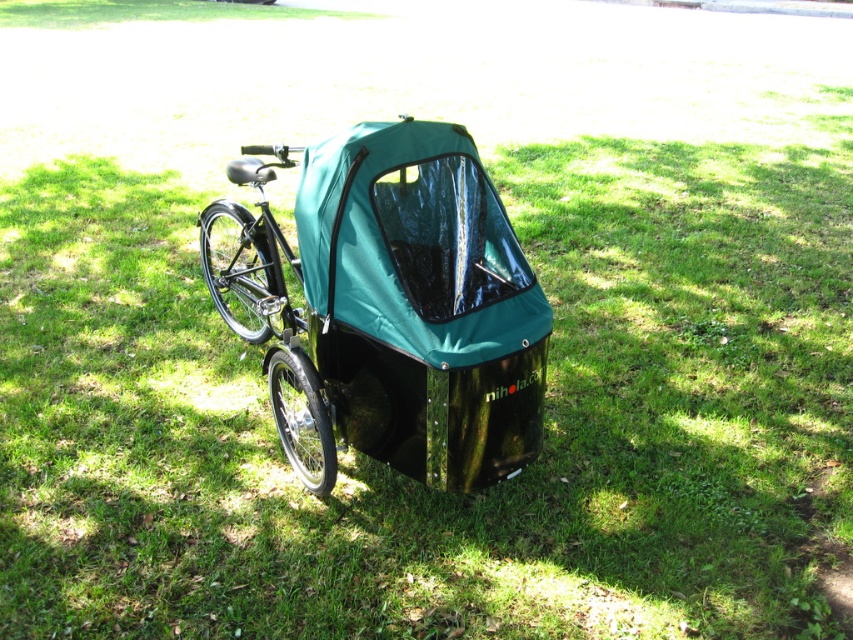
Consider the image. You are standing in a park and see a bicycle with a child trailer attached to its rear. The trailer has a large transparent window at the front and is dark teal in color. There is a point marked at coordinates [387,307]. Based on the scene description, where is this point located?

The point at coordinates [387,307] marks the location of the teal glossy baby carriage at center.